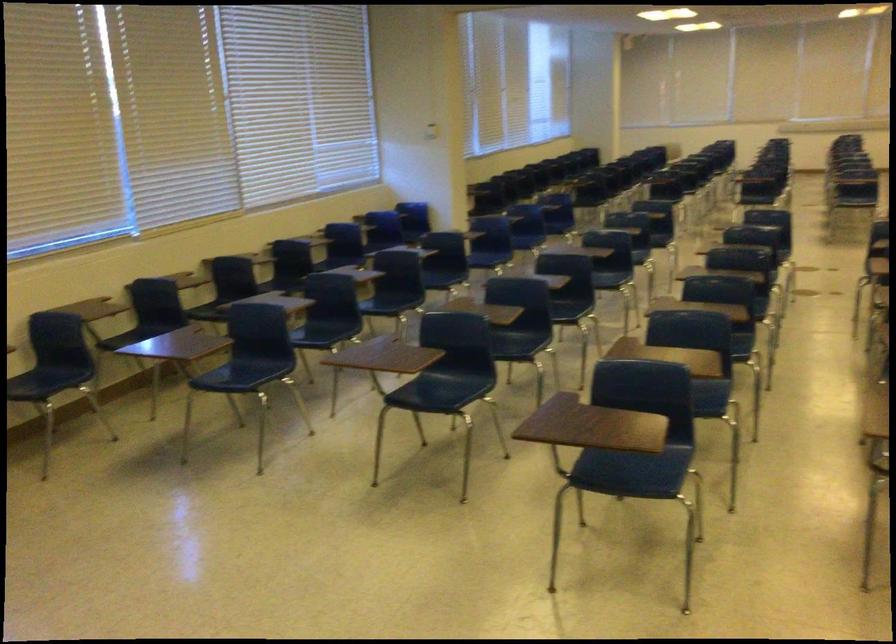
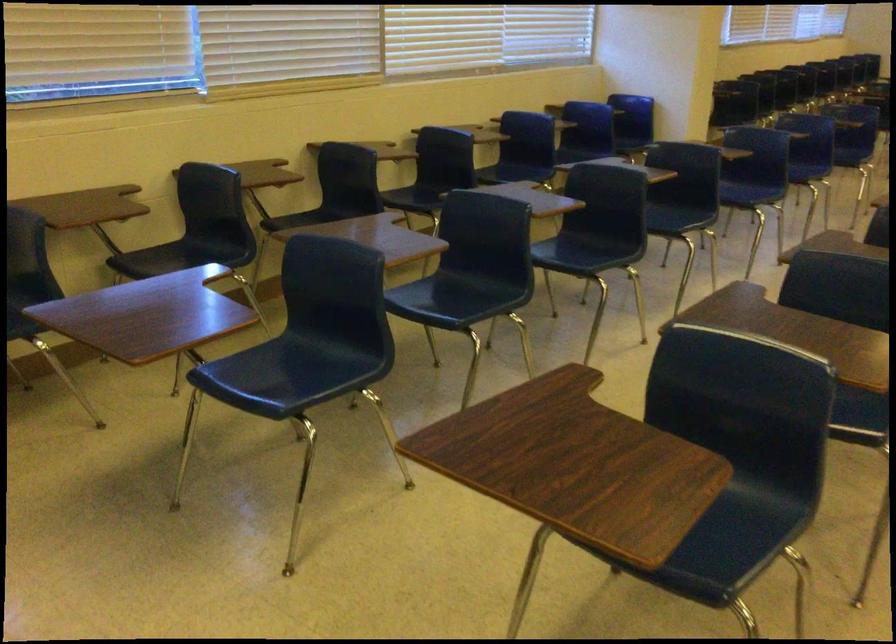
Question: In a continuous first-person perspective shot, in which direction is the camera moving?

Choices:
 (A) Left
 (B) Right
 (C) Forward
 (D) Backward

Answer: (C)